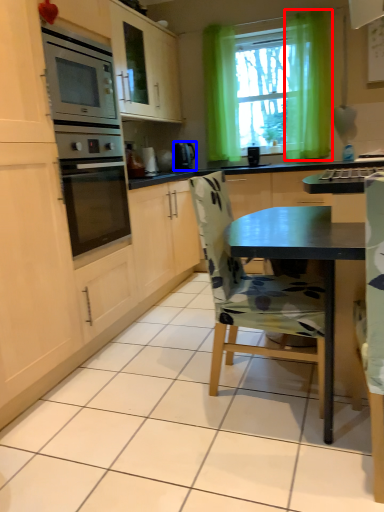
Question: Which object is closer to the camera taking this photo, curtain (highlighted by a red box) or kitchen appliance (highlighted by a blue box)?

Choices:
 (A) curtain
 (B) kitchen appliance

Answer: (A)